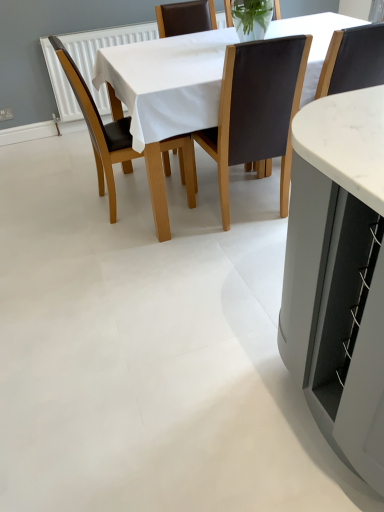
Question: Would you say white fabric table at center is a long distance from brown leather chair at center, acting as the second chair starting from the right?

Choices:
 (A) no
 (B) yes

Answer: (A)

Question: Considering the relative positions of white fabric table at center and brown leather chair at center, acting as the second chair starting from the right, in the image provided, is white fabric table at center to the left of brown leather chair at center, acting as the second chair starting from the right, from the viewer's perspective?

Choices:
 (A) no
 (B) yes

Answer: (A)

Question: Is white fabric table at center not within brown leather chair at center, positioned as the second chair in left-to-right order?

Choices:
 (A) no
 (B) yes

Answer: (B)

Question: Considering the relative sizes of white fabric table at center and brown leather chair at center, positioned as the second chair in left-to-right order, in the image provided, is white fabric table at center bigger than brown leather chair at center, positioned as the second chair in left-to-right order,?

Choices:
 (A) yes
 (B) no

Answer: (A)

Question: Does white fabric table at center turn towards brown leather chair at center, acting as the second chair starting from the right?

Choices:
 (A) yes
 (B) no

Answer: (A)

Question: Is white fabric table at center looking in the opposite direction of brown leather chair at center, positioned as the second chair in left-to-right order?

Choices:
 (A) yes
 (B) no

Answer: (A)

Question: Is black leather chair at center, acting as the 1th chair starting from the right, taller than brown leather chair at center, positioned as the second chair in left-to-right order?

Choices:
 (A) no
 (B) yes

Answer: (A)

Question: Can you confirm if black leather chair at center, the 3th chair viewed from the left, is bigger than brown leather chair at center, positioned as the second chair in left-to-right order?

Choices:
 (A) no
 (B) yes

Answer: (A)

Question: Is black leather chair at center, the 3th chair viewed from the left, further to camera compared to brown leather chair at center, positioned as the second chair in left-to-right order?

Choices:
 (A) yes
 (B) no

Answer: (A)

Question: From the image's perspective, would you say black leather chair at center, the 3th chair viewed from the left, is shown under brown leather chair at center, acting as the second chair starting from the right?

Choices:
 (A) no
 (B) yes

Answer: (A)

Question: Is black leather chair at center, acting as the 1th chair starting from the right, to the left of brown leather chair at center, positioned as the second chair in left-to-right order, from the viewer's perspective?

Choices:
 (A) no
 (B) yes

Answer: (A)

Question: Could brown leather chair at center, acting as the second chair starting from the right, be considered to be inside black leather chair at center, acting as the 1th chair starting from the right?

Choices:
 (A) yes
 (B) no

Answer: (B)

Question: Is brown leather chair at center, arranged as the 1th chair when viewed from the left, turned away from white fabric table at center?

Choices:
 (A) yes
 (B) no

Answer: (A)